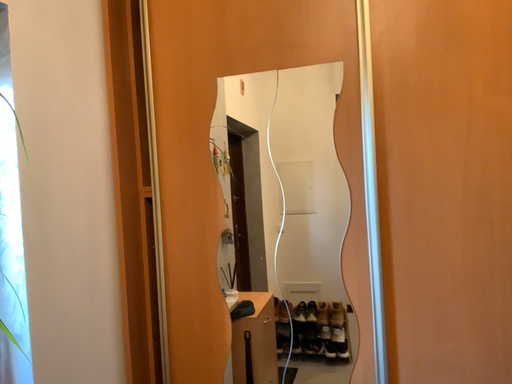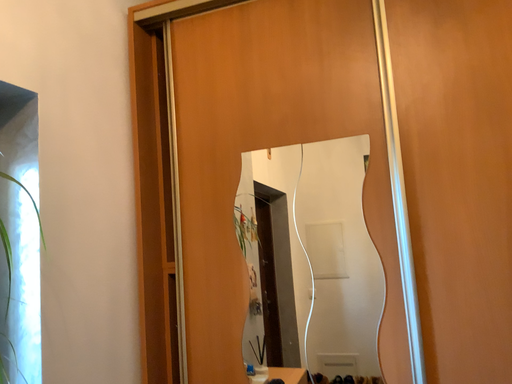
Question: Which way did the camera rotate in the video?

Choices:
 (A) rotated upward
 (B) rotated downward

Answer: (A)